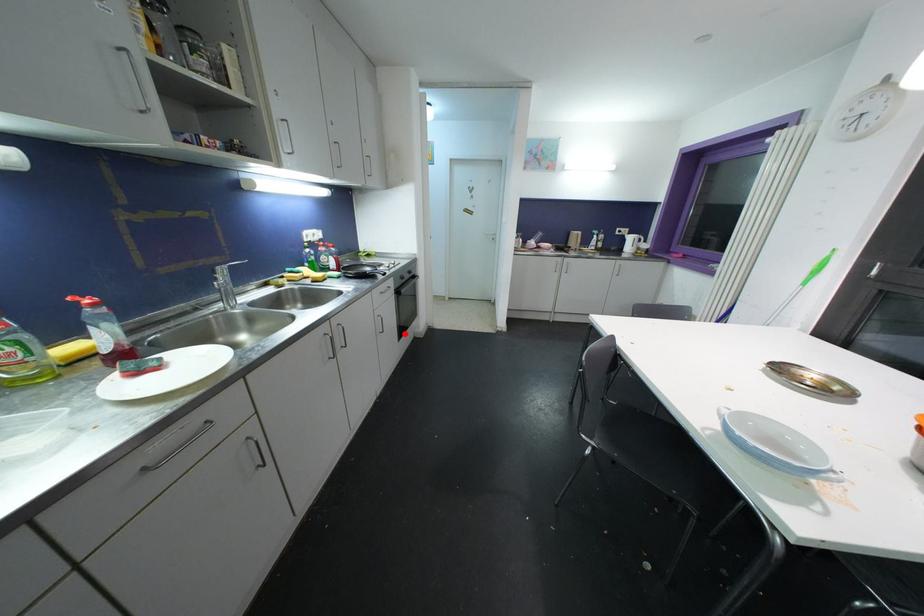
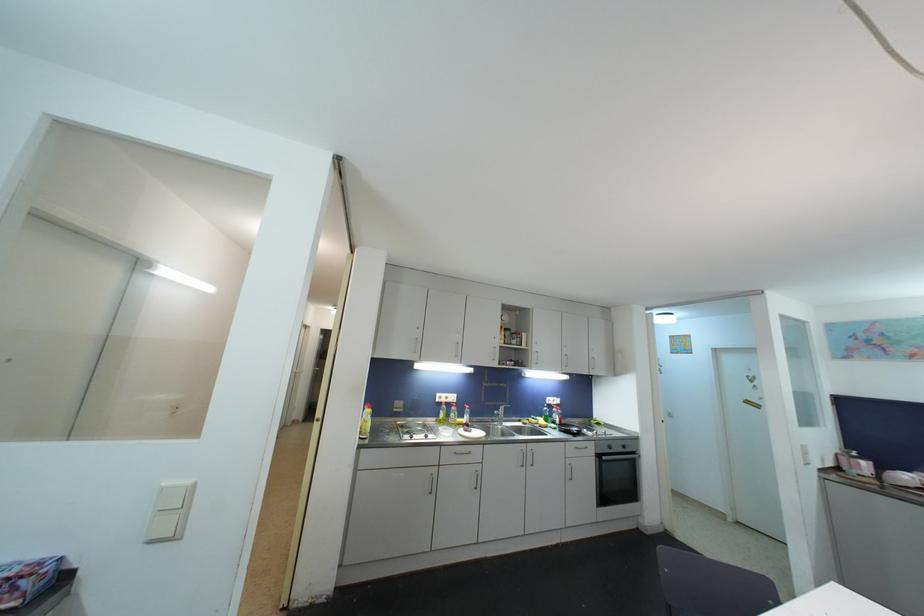
Find the pixel in the second image that matches the highlighted location in the first image.

(608, 501)